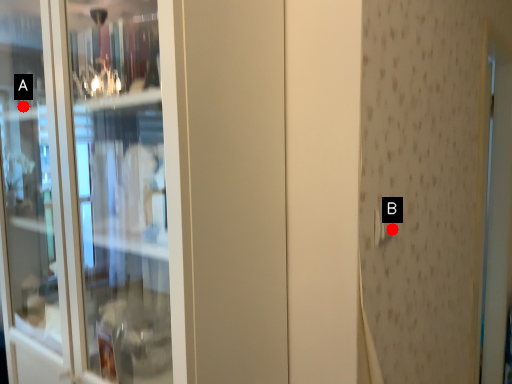
Question: Two points are circled on the image, labeled by A and B beside each circle. Which point is closer to the camera taking this photo?

Choices:
 (A) A is closer
 (B) B is closer

Answer: (B)